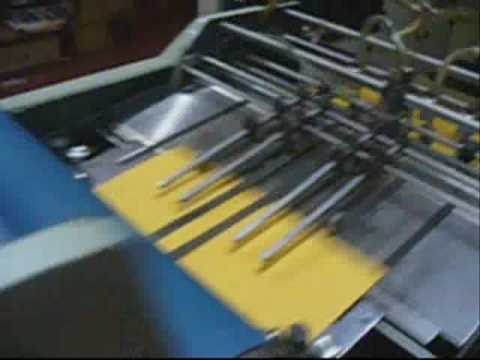
At what (x,y) coordinates should I click in order to perform the action: click on rod. Please return your answer as a coordinate pair (x, y). The image size is (480, 360). Looking at the image, I should click on (436, 135).